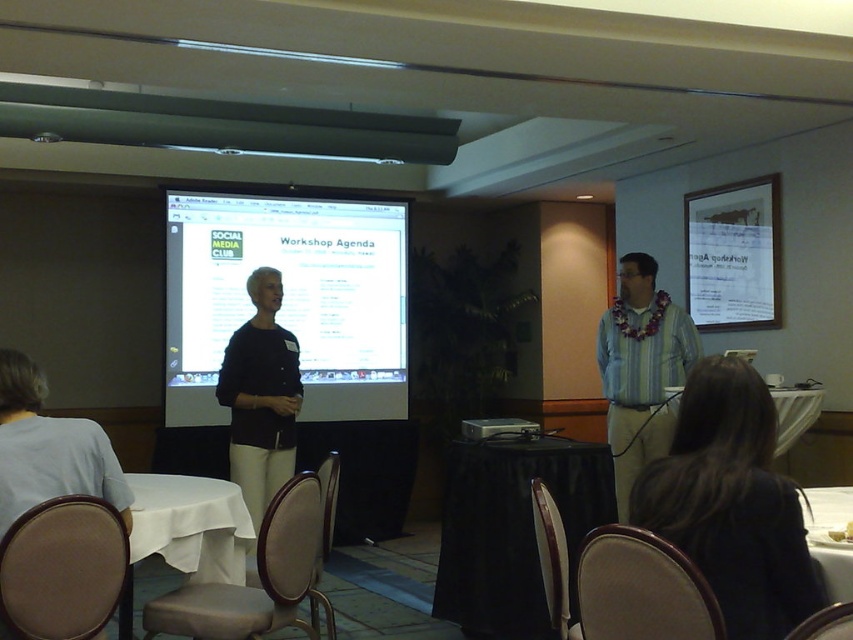
Can you confirm if white glossy table at lower right is positioned above white tablecloth at lower right?

No.

Which is more to the left, white glossy table at lower right or white tablecloth at lower right?

white glossy table at lower right

Which is behind, point (820, 502) or point (809, 396)?

The point (809, 396) is behind.

I want to click on white glossy table at lower right, so click(x=830, y=540).

Which is in front, point (358, 342) or point (506, 433)?

Positioned in front is point (506, 433).

Does point (386, 385) lie behind point (467, 426)?

Yes, it is behind point (467, 426).

Is point (345, 397) more distant than point (503, 420)?

Yes, point (345, 397) is behind point (503, 420).

Image resolution: width=853 pixels, height=640 pixels. I want to click on white glossy projector screen at center, so click(288, 298).

Find the location of a particular element. The image size is (853, 640). black matte sweater at center is located at coordinates (260, 396).

Which is more to the right, black matte sweater at center or white glossy table at lower right?

white glossy table at lower right

Identify the location of black matte sweater at center. Image resolution: width=853 pixels, height=640 pixels. (260, 396).

Image resolution: width=853 pixels, height=640 pixels. Find the location of `black matte sweater at center`. black matte sweater at center is located at coordinates (260, 396).